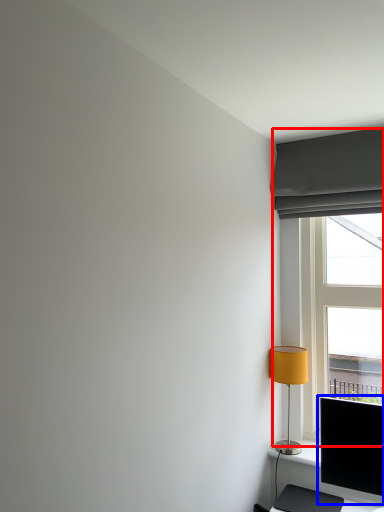
Question: Which point is further to the camera, window (highlighted by a red box) or computer monitor (highlighted by a blue box)?

Choices:
 (A) window
 (B) computer monitor

Answer: (A)